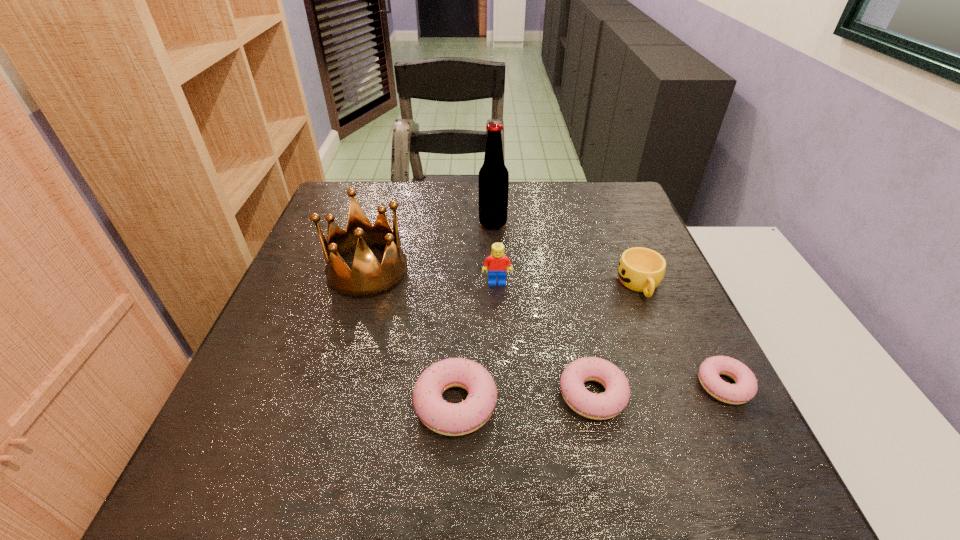
I want to click on doughnut situated at the right edge, so click(x=746, y=387).

Locate an element on the screen. The height and width of the screenshot is (540, 960). cup situated at the right edge is located at coordinates (640, 269).

Identify the location of object that is at the near right corner. (746, 387).

Locate an element on the screen. free space at the far edge of the desktop is located at coordinates (392, 181).

Locate an element on the screen. The height and width of the screenshot is (540, 960). vacant space at the near edge of the desktop is located at coordinates (397, 434).

Locate an element on the screen. The height and width of the screenshot is (540, 960). vacant region at the left edge of the desktop is located at coordinates (287, 289).

Locate an element on the screen. free space at the far left corner of the desktop is located at coordinates click(356, 195).

Where is `free region at the far right corner of the desktop`? free region at the far right corner of the desktop is located at coordinates (604, 225).

Find the location of a particular element. Image resolution: width=960 pixels, height=540 pixels. empty location between the beer bottle and the leftmost doughnut is located at coordinates (474, 314).

Identify the location of free space between the cup and the shortest doughnut. (682, 335).